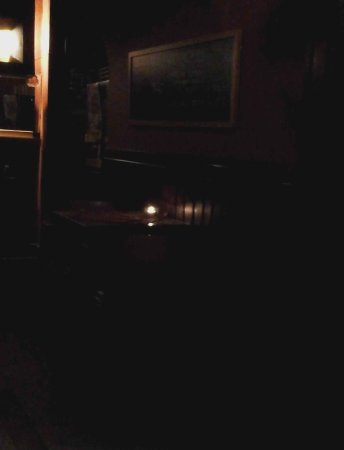
Identify the location of painting. This screenshot has height=450, width=344. (211, 110).